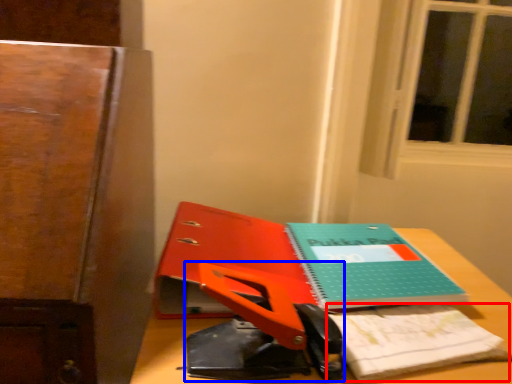
Question: Which point is further to the camera, notepad (highlighted by a red box) or scissors (highlighted by a blue box)?

Choices:
 (A) notepad
 (B) scissors

Answer: (A)